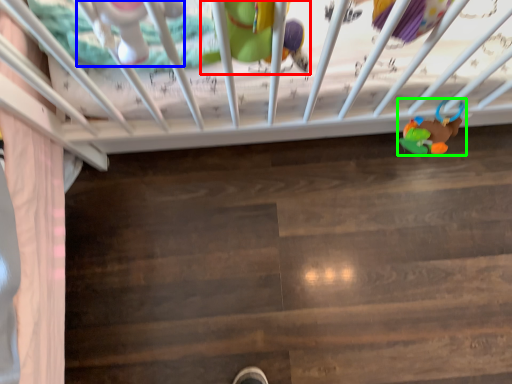
Question: Which object is the farthest from toy (highlighted by a red box)? Choose among these: toy (highlighted by a blue box) or toy (highlighted by a green box).

Choices:
 (A) toy
 (B) toy

Answer: (B)